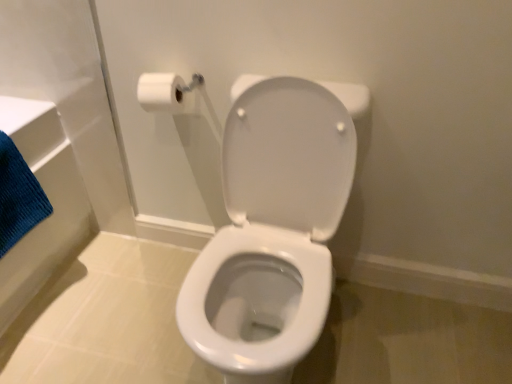
Question: From a real-world perspective, is white glossy toilet at center beneath blue textured bath towel at left?

Choices:
 (A) no
 (B) yes

Answer: (B)

Question: Considering the relative positions of white glossy toilet at center and blue textured bath towel at left in the image provided, is white glossy toilet at center to the right of blue textured bath towel at left from the viewer's perspective?

Choices:
 (A) yes
 (B) no

Answer: (A)

Question: Considering the relative sizes of white glossy toilet at center and blue textured bath towel at left in the image provided, is white glossy toilet at center taller than blue textured bath towel at left?

Choices:
 (A) no
 (B) yes

Answer: (B)

Question: Is there a large distance between white glossy toilet at center and blue textured bath towel at left?

Choices:
 (A) yes
 (B) no

Answer: (B)

Question: Is white glossy toilet at center facing away from blue textured bath towel at left?

Choices:
 (A) yes
 (B) no

Answer: (B)

Question: Is white glossy toilet at center next to blue textured bath towel at left?

Choices:
 (A) yes
 (B) no

Answer: (B)

Question: Can you confirm if blue textured bath towel at left is taller than white glossy toilet at center?

Choices:
 (A) no
 (B) yes

Answer: (A)

Question: Considering the relative sizes of blue textured bath towel at left and white glossy toilet at center in the image provided, is blue textured bath towel at left bigger than white glossy toilet at center?

Choices:
 (A) yes
 (B) no

Answer: (B)

Question: Could white glossy toilet at center be considered to be inside blue textured bath towel at left?

Choices:
 (A) no
 (B) yes

Answer: (A)

Question: Is blue textured bath towel at left shorter than white glossy toilet at center?

Choices:
 (A) yes
 (B) no

Answer: (A)

Question: Can you confirm if blue textured bath towel at left is wider than white glossy toilet at center?

Choices:
 (A) no
 (B) yes

Answer: (A)

Question: Is blue textured bath towel at left turned away from white glossy toilet at center?

Choices:
 (A) yes
 (B) no

Answer: (B)

Question: Is white glossy toilet at center completely or partially outside of white matte toilet paper at upper left?

Choices:
 (A) yes
 (B) no

Answer: (A)